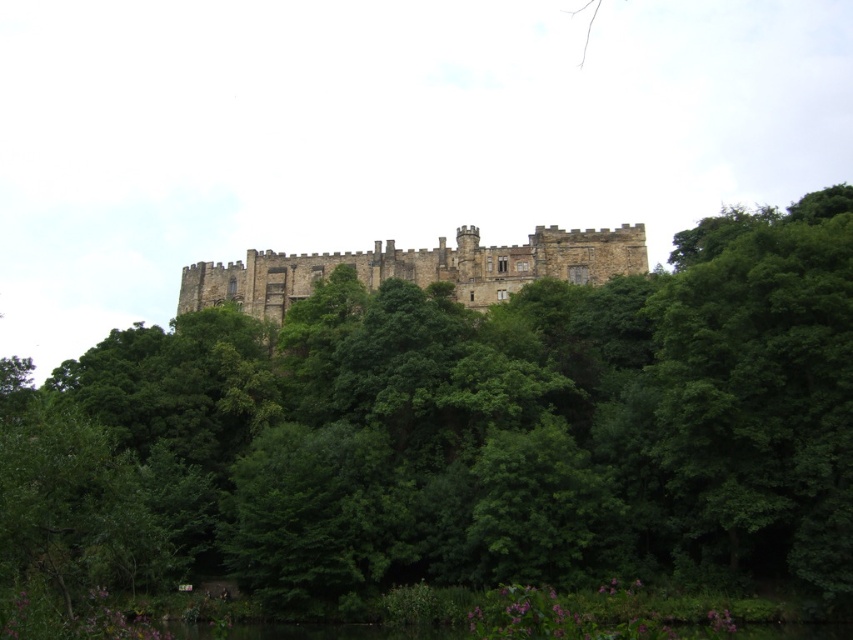
Question: Is green leafy tree at center to the right of brown stone castle at center from the viewer's perspective?

Choices:
 (A) no
 (B) yes

Answer: (B)

Question: Which of the following is the farthest from the observer?

Choices:
 (A) (479, 241)
 (B) (213, 364)

Answer: (A)

Question: Which point is farther to the camera?

Choices:
 (A) (474, 298)
 (B) (810, 400)

Answer: (A)

Question: Which object appears closest to the camera in this image?

Choices:
 (A) green leafy tree at center
 (B) brown stone castle at center

Answer: (A)

Question: Is the position of green leafy tree at center less distant than that of brown stone castle at center?

Choices:
 (A) no
 (B) yes

Answer: (B)

Question: Is green leafy tree at center thinner than brown stone castle at center?

Choices:
 (A) no
 (B) yes

Answer: (A)